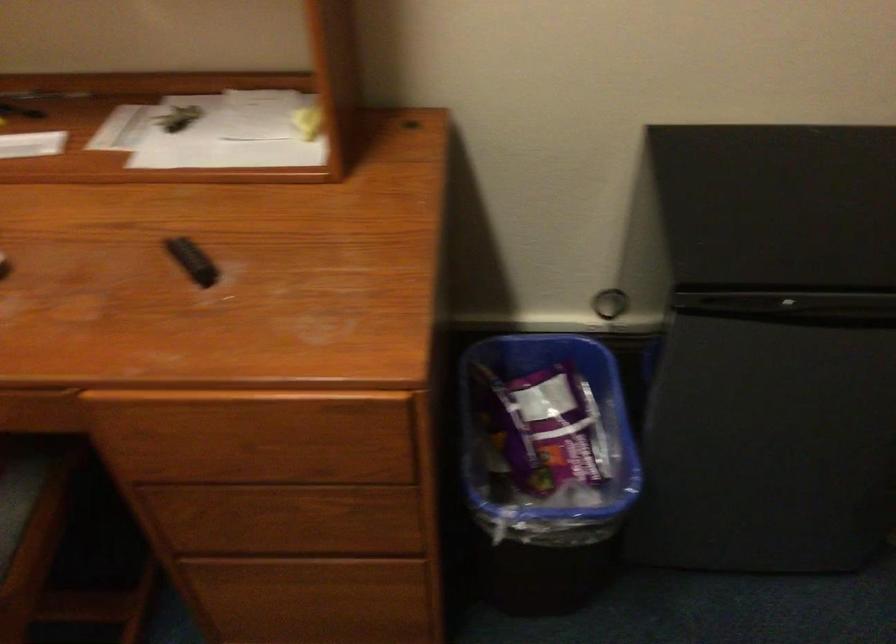
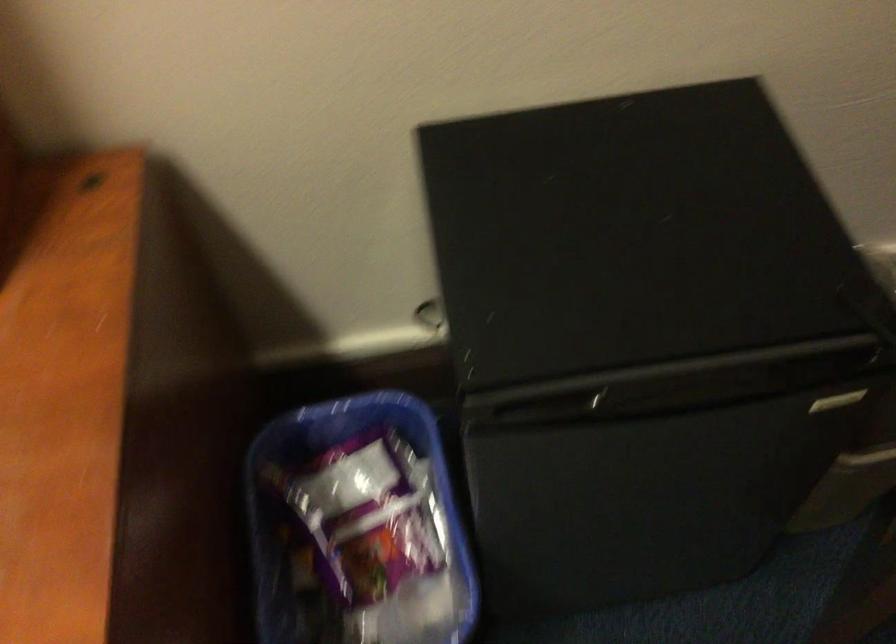
What movement of the cameraman would produce the second image?

The movement direction of the cameraman is right, forward.